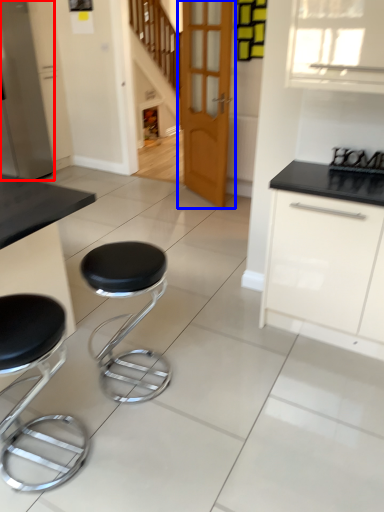
Question: Which point is closer to the camera, appliance (highlighted by a red box) or door (highlighted by a blue box)?

Choices:
 (A) appliance
 (B) door

Answer: (B)